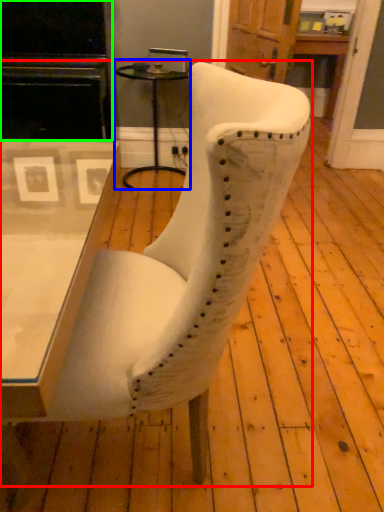
Question: Which object is the farthest from chair (highlighted by a red box)? Choose among these: side table (highlighted by a blue box) or entertainment center (highlighted by a green box).

Choices:
 (A) side table
 (B) entertainment center

Answer: (A)